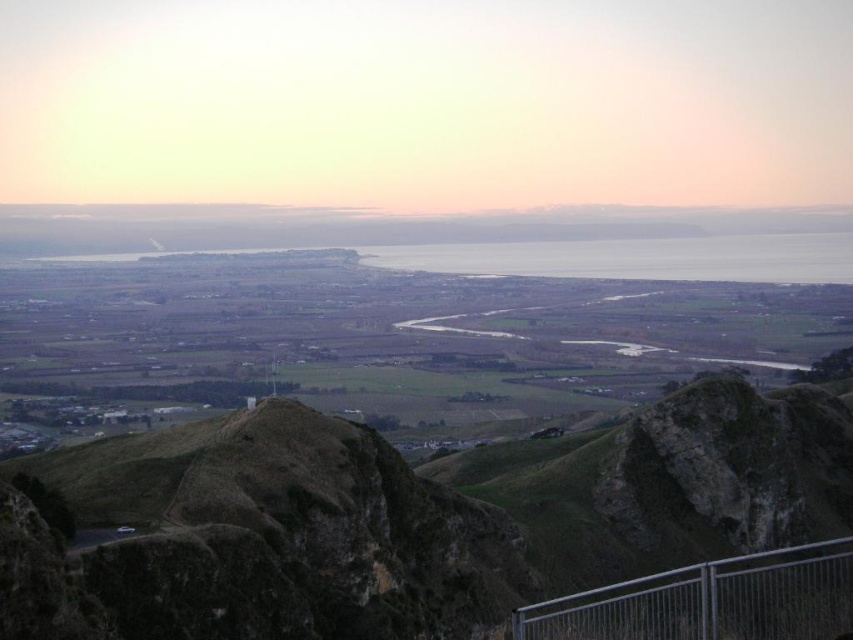
Which is above, brown rocky mountain at center or metallic silver rail at lower right?

Positioned higher is metallic silver rail at lower right.

How distant is brown rocky mountain at center from metallic silver rail at lower right?

brown rocky mountain at center and metallic silver rail at lower right are 74.36 meters apart from each other.

Which is in front, point (468, 508) or point (843, 620)?

Point (843, 620) is more forward.

In order to click on brown rocky mountain at center in this screenshot , I will do `click(250, 538)`.